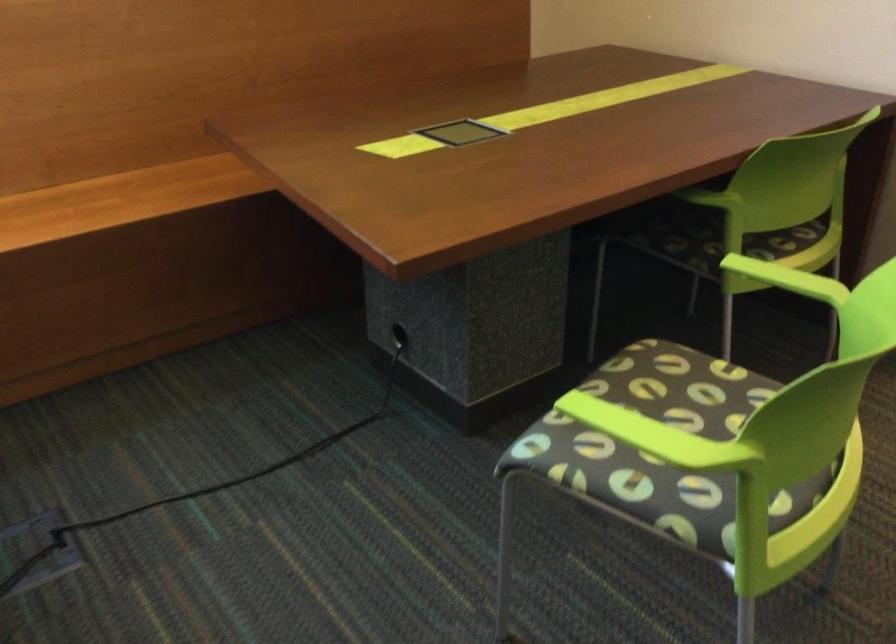
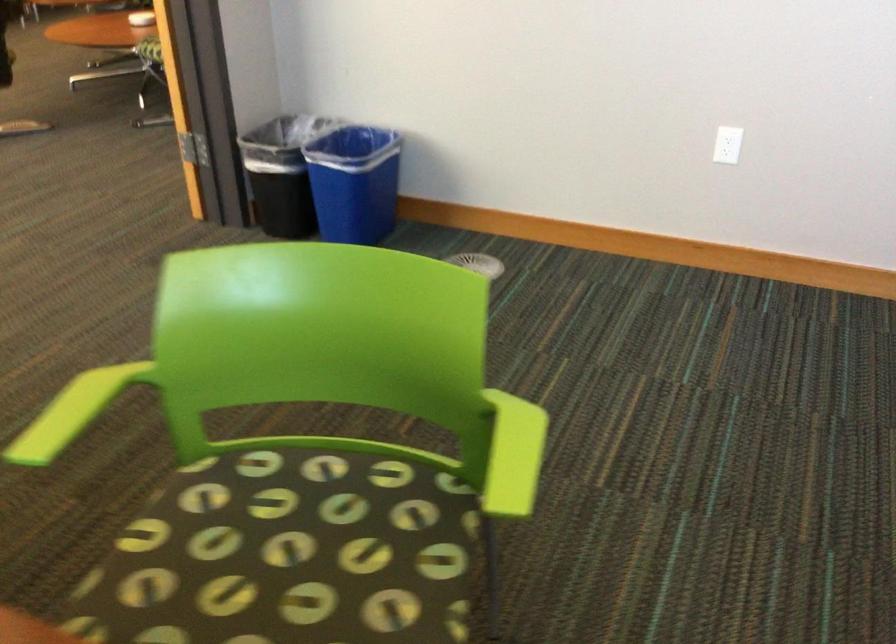
Find the pixel in the second image that matches point 686,424 in the first image.

(297, 545)